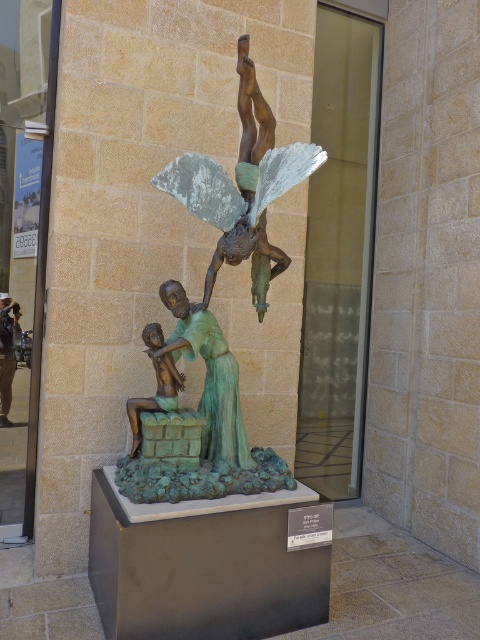
You are a maintenance worker tasked with cleaning the green patina bronze sculpture at center and the green patina statue at center. You have a 6 inch long cleaning tool. Can you safely clean both objects without needing to move the tool between them?

The green patina bronze sculpture at center and green patina statue at center are 6.27 inches apart from each other, so the 6 inch tool is not long enough to reach both objects without moving it. You will need to move the tool between them.

You are an art student observing the green patina bronze sculpture at center and the bronze figure at center in the image. Which one has a greater height?

The green patina bronze sculpture at center is taller than the bronze figure at center.